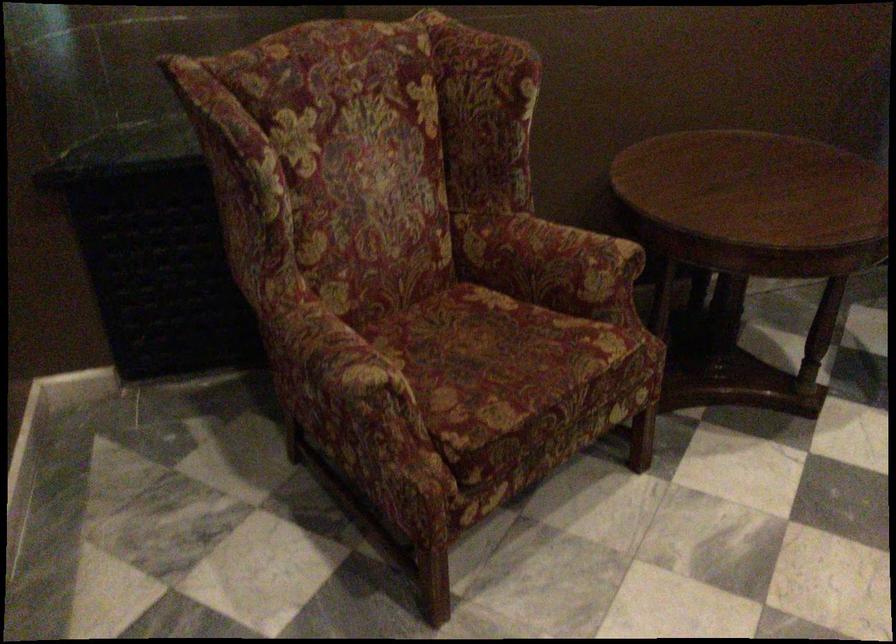
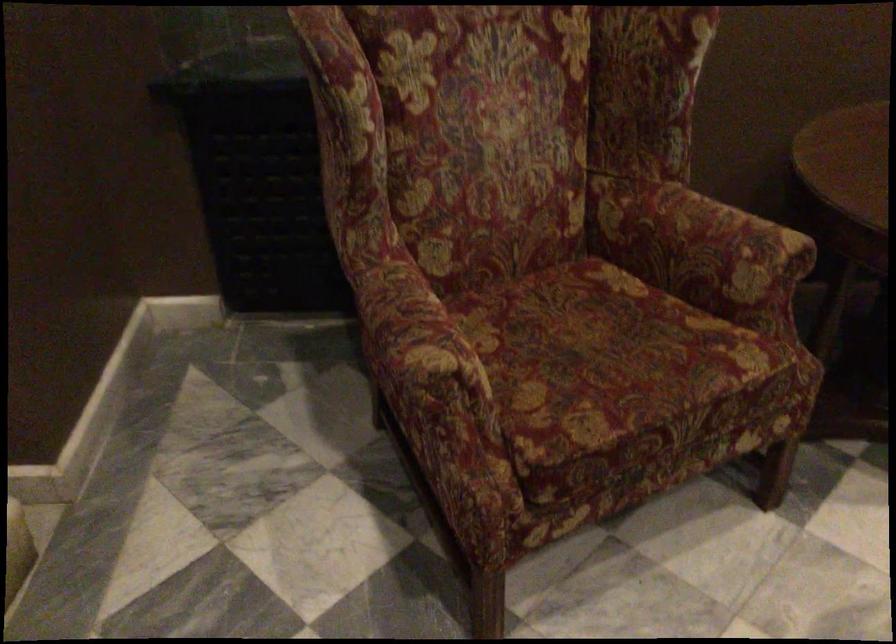
The point at (501,361) is marked in the first image. Where is the corresponding point in the second image?

(606, 361)